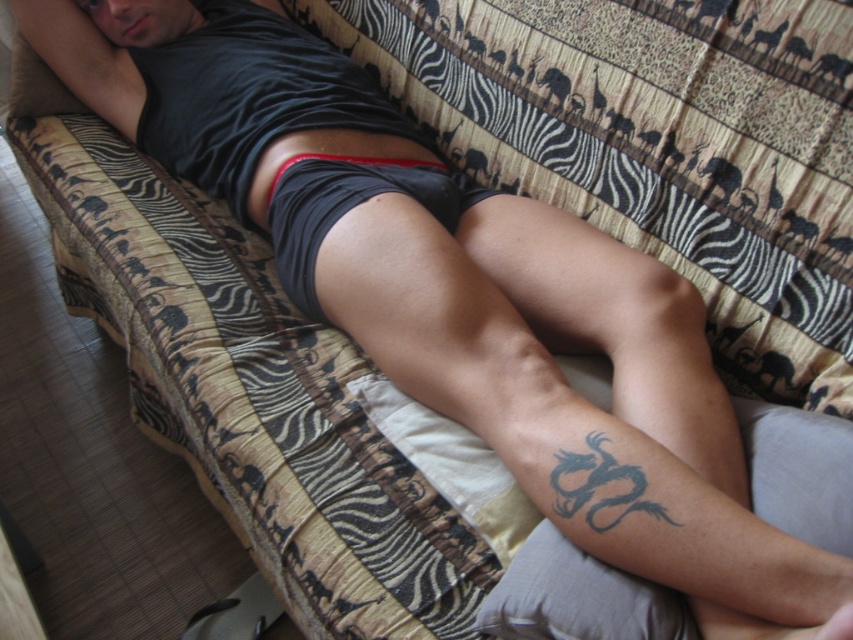
Who is lower down, gray fabric pillow at lower right or black matte shorts at center?

Positioned lower is gray fabric pillow at lower right.

Can you confirm if gray fabric pillow at lower right is thinner than black matte shorts at center?

No, gray fabric pillow at lower right is not thinner than black matte shorts at center.

Where is `gray fabric pillow at lower right`? gray fabric pillow at lower right is located at coordinates (578, 596).